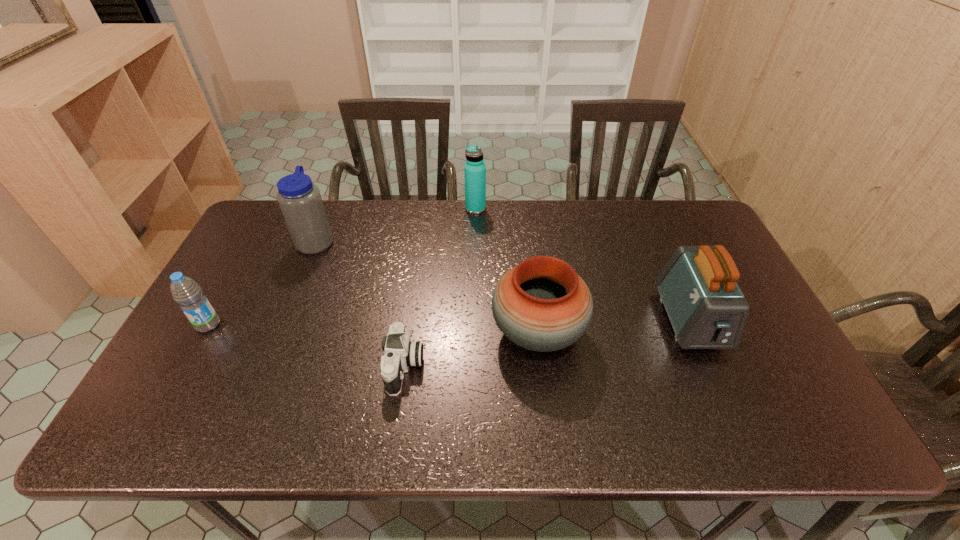
Identify the location of the farthest water bottle. This screenshot has height=540, width=960. (474, 169).

Where is `the farthest object`? Image resolution: width=960 pixels, height=540 pixels. the farthest object is located at coordinates (474, 169).

Image resolution: width=960 pixels, height=540 pixels. What are the coordinates of `the second nearest water bottle` in the screenshot? It's located at (300, 201).

Find the location of a particular element. The width and height of the screenshot is (960, 540). the second object from left to right is located at coordinates (300, 201).

The height and width of the screenshot is (540, 960). Find the location of `the rightmost object`. the rightmost object is located at coordinates (707, 310).

Identify the location of the fifth object from left to right. The width and height of the screenshot is (960, 540). pos(542,304).

Identify the location of the leftmost water bottle. This screenshot has height=540, width=960. (186, 292).

I want to click on the shortest water bottle, so click(186, 292).

Find the location of a particular element. the fourth object from right to left is located at coordinates (400, 353).

Image resolution: width=960 pixels, height=540 pixels. Identify the location of camera. (400, 353).